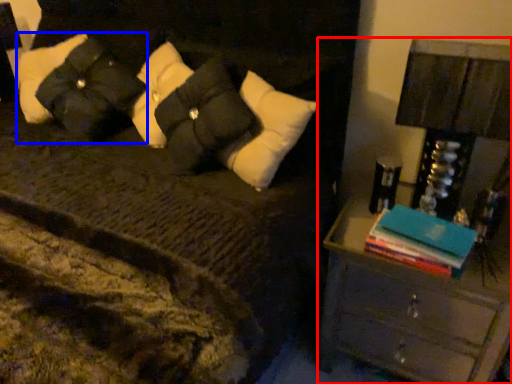
Question: Which object appears farthest to the camera in this image, nightstand (highlighted by a red box) or pillow (highlighted by a blue box)?

Choices:
 (A) nightstand
 (B) pillow

Answer: (B)